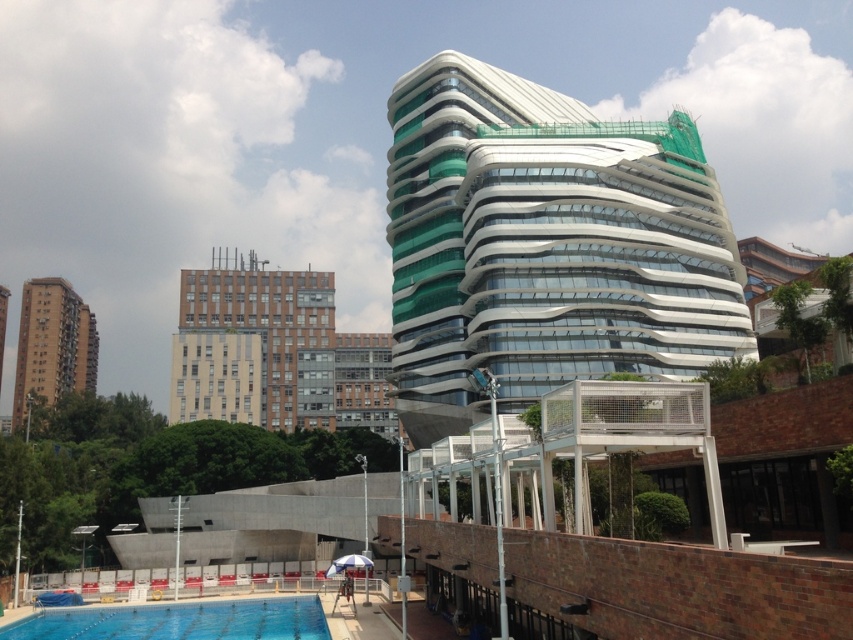
Is white glass building at center smaller than brown concrete building at left?

Indeed, white glass building at center has a smaller size compared to brown concrete building at left.

Between white glass building at center and brown concrete building at left, which one has less height?

brown concrete building at left

Identify the location of white glass building at center. Image resolution: width=853 pixels, height=640 pixels. (544, 244).

Where is `white glass building at center`? white glass building at center is located at coordinates (544, 244).

Who is shorter, brown brick building at upper left or brown concrete building at left?

With less height is brown concrete building at left.

Does brown brick building at upper left appear over brown concrete building at left?

Yes, brown brick building at upper left is above brown concrete building at left.

Where is `brown brick building at upper left`? This screenshot has height=640, width=853. brown brick building at upper left is located at coordinates (276, 352).

Is point (218, 314) more distant than point (74, 634)?

Yes, it is behind point (74, 634).

Is brown brick building at upper left closer to camera compared to blue glass swimming pool at lower left?

That is False.

Who is more forward, [187,275] or [120,636]?

Positioned in front is point [120,636].

What are the coordinates of `brown brick building at upper left` in the screenshot? It's located at (276, 352).